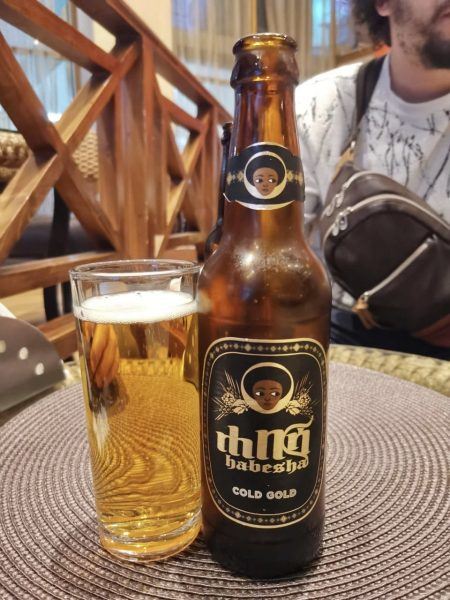
Identify the location of wooden railing. (144, 133).